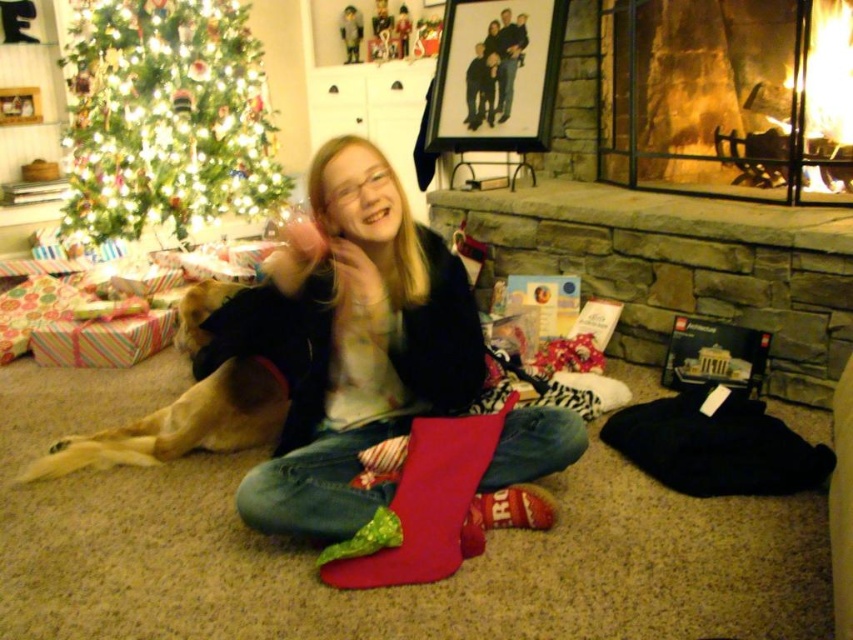
Which is below, brick fireplace at right or red velvet stocking at lower center?

red velvet stocking at lower center is below.

Locate an element on the screen. This screenshot has width=853, height=640. brick fireplace at right is located at coordinates (727, 97).

The width and height of the screenshot is (853, 640). Describe the element at coordinates (727, 97) in the screenshot. I see `brick fireplace at right` at that location.

At what (x,y) coordinates should I click in order to perform the action: click on brick fireplace at right. Please return your answer as a coordinate pair (x, y). The image size is (853, 640). Looking at the image, I should click on (727, 97).

Can you confirm if matte red stocking at center is wider than green artificial christmas tree at upper left?

No.

Which of these two, matte red stocking at center or green artificial christmas tree at upper left, stands shorter?

With less height is matte red stocking at center.

Image resolution: width=853 pixels, height=640 pixels. I want to click on matte red stocking at center, so click(x=352, y=342).

Does matte red stocking at center have a greater width compared to red velvet stocking at lower center?

Indeed, matte red stocking at center has a greater width compared to red velvet stocking at lower center.

Between matte red stocking at center and red velvet stocking at lower center, which one appears on the left side from the viewer's perspective?

Positioned to the left is matte red stocking at center.

Describe the element at coordinates (352, 342) in the screenshot. I see `matte red stocking at center` at that location.

What are the coordinates of `matte red stocking at center` in the screenshot? It's located at (352, 342).